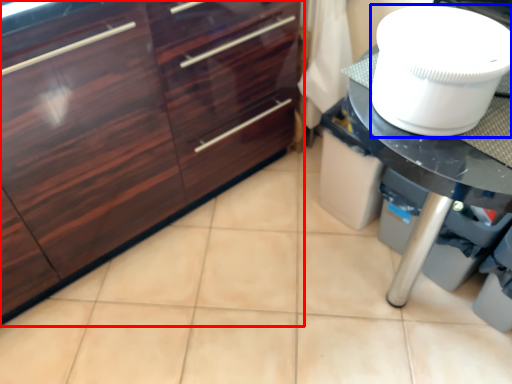
Question: Which object appears closest to the camera in this image, cabinetry (highlighted by a red box) or toilet bowl (highlighted by a blue box)?

Choices:
 (A) cabinetry
 (B) toilet bowl

Answer: (B)